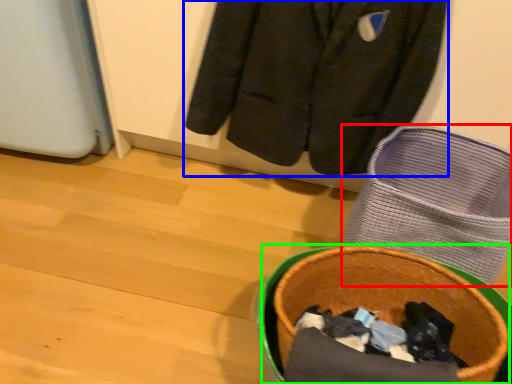
Question: Which is nearer to the footwear (highlighted by a red box)? jacket (highlighted by a blue box) or basket container (highlighted by a green box).

Choices:
 (A) jacket
 (B) basket container

Answer: (A)